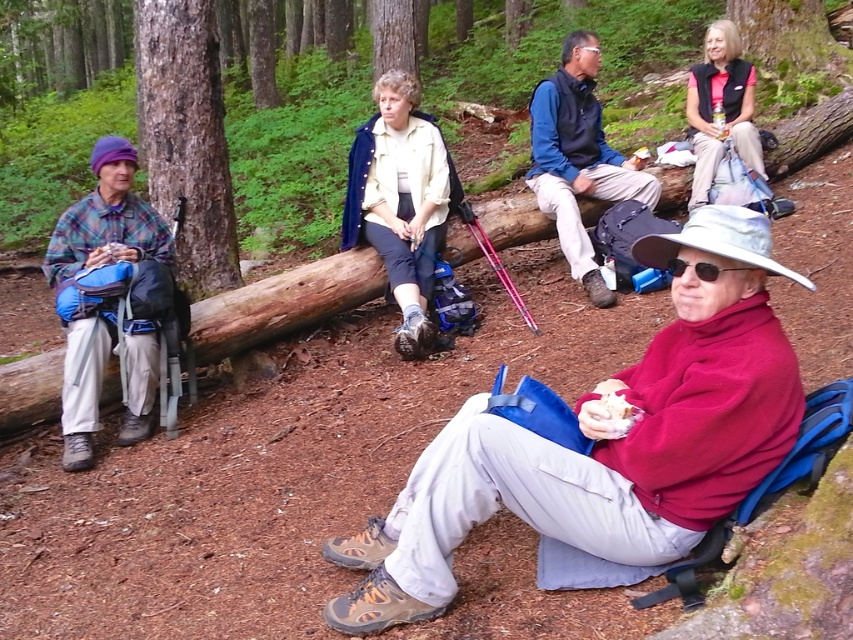
Question: Can you confirm if smooth bark tree at left is bigger than black plastic sunglasses at lower center?

Choices:
 (A) yes
 (B) no

Answer: (A)

Question: Considering the real-world distances, which object is farthest from the blue fabric backpack at center?

Choices:
 (A) smooth bark tree at center
 (B) plaid fabric shirt at left
 (C) matte black vest at upper right

Answer: (A)

Question: Can you confirm if plaid fabric shirt at left is positioned to the left of blue fabric backpack at center?

Choices:
 (A) yes
 (B) no

Answer: (A)

Question: Which point is closer to the camera taking this photo?

Choices:
 (A) (563, 150)
 (B) (677, 266)
 (C) (227, 253)
 (D) (397, 20)

Answer: (B)

Question: Which of the following is the farthest from the observer?

Choices:
 (A) (229, 228)
 (B) (412, 51)
 (C) (746, 268)

Answer: (B)

Question: Does smooth bark tree at left have a larger size compared to plaid fabric shirt at left?

Choices:
 (A) yes
 (B) no

Answer: (B)